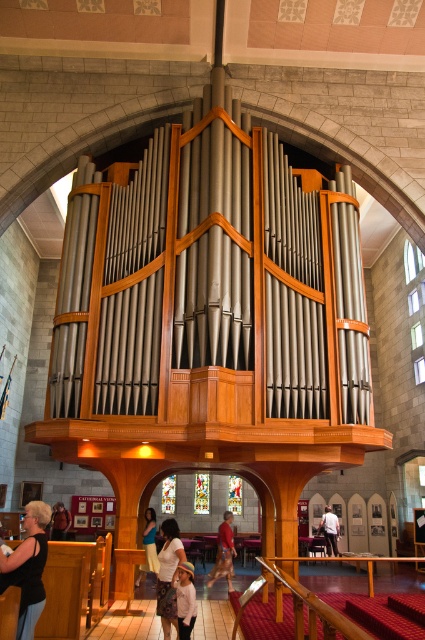
You are standing in the cathedral and see the white cotton shirt at lower center. There is a small golden cross hanging 15.83 meters away from it. Can you walk directly from the shirt to the cross without any obstacles?

The white cotton shirt at lower center and the small golden cross are 15.83 meters apart. Since the cathedral has a large open space with arched ceilings and no mention of obstacles between them, you can walk directly from the shirt to the cross without any obstacles.

You are standing in the cathedral and see both the matte black shirt at lower left and the light blue fabric dress at center. Which clothing item is located to the left of the other?

The matte black shirt at lower left is positioned on the left side of light blue fabric dress at center.

You are standing in the cathedral facing the pipe organ. There are two points marked on the floor in front of you. One is at coordinates point [190,596] and the other is at point [53,532]. Which point is closer to you when you are facing the organ?

Point [190,596] is in front of point [53,532], so the point [190,596] is closer to you when facing the organ.